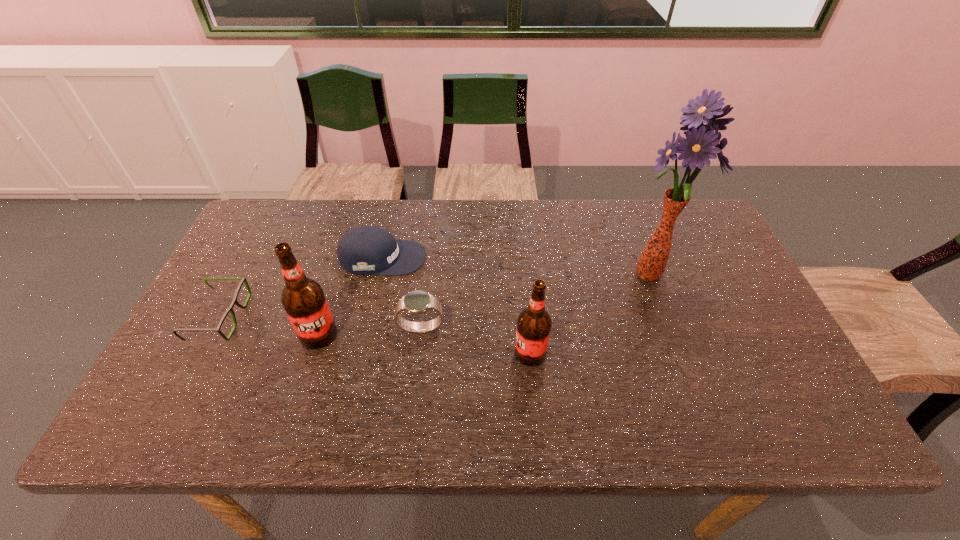
Please point a spot on the right to add another root beer. Please provide its 2D coordinates. Your answer should be formatted as a tuple, i.e. [(x, y)], where the tuple contains the x and y coordinates of a point satisfying the conditions above.

[(757, 374)]